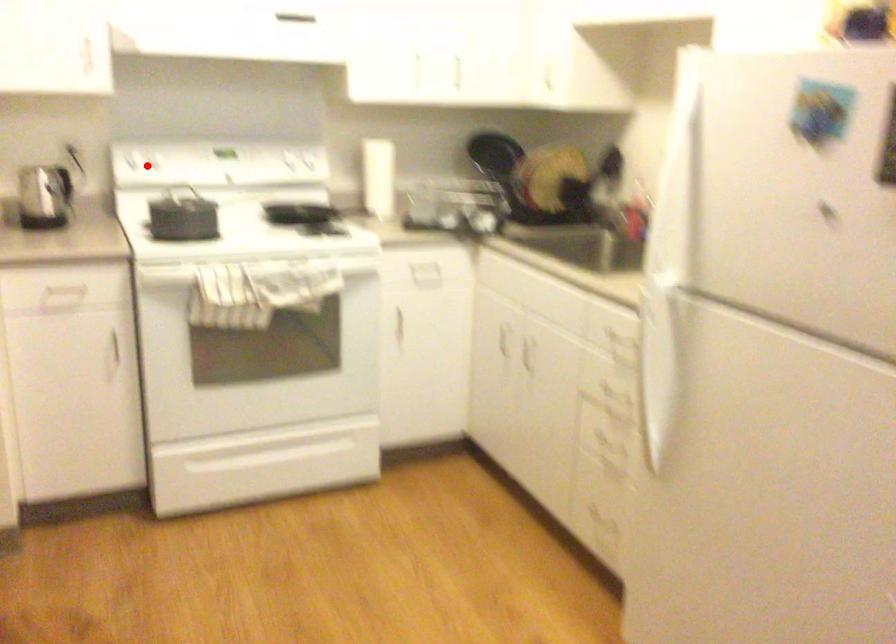
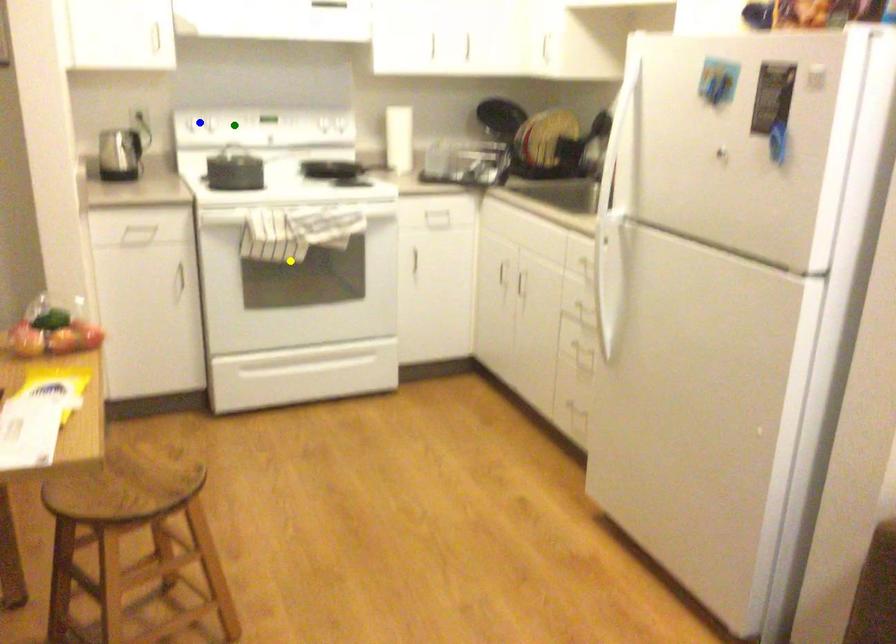
Question: I am providing you with two images of the same scene from different viewpoints. A red point is marked on the first image. You are given multiple points on the second image. Can you choose the point in image 2 that corresponds to the point in image 1?

Choices:
 (A) yellow point
 (B) green point
 (C) blue point

Answer: (C)